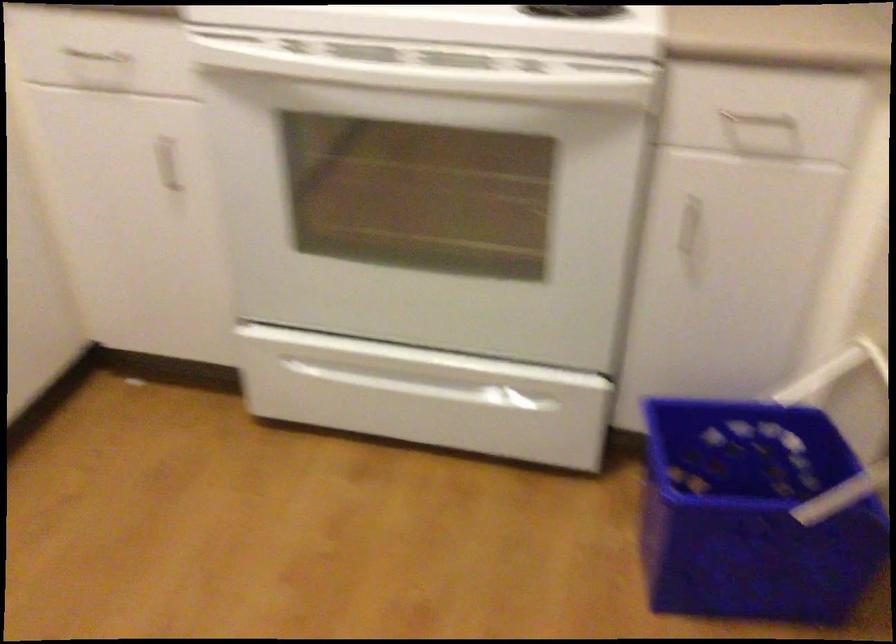
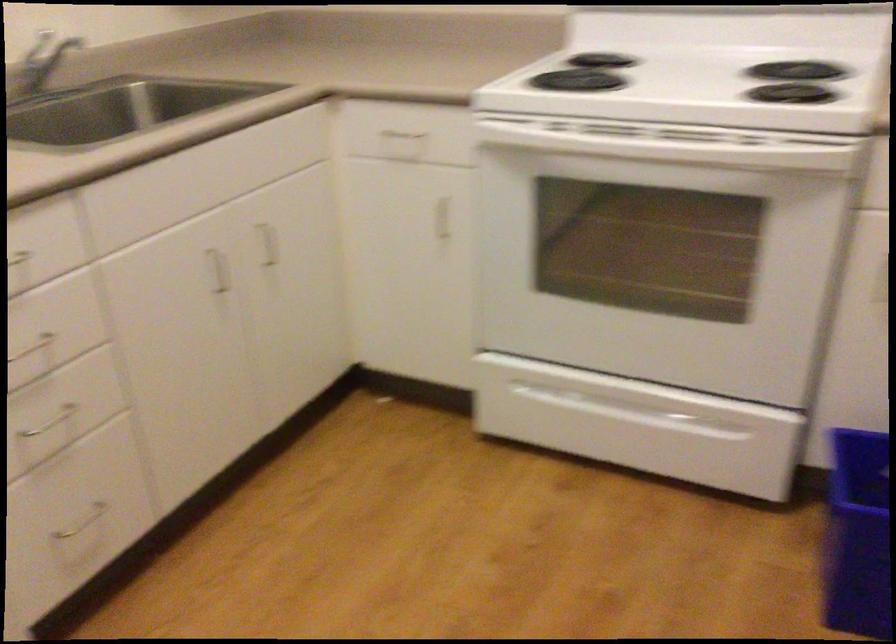
Question: How did the camera likely rotate?

Choices:
 (A) Left
 (B) Right
 (C) Up
 (D) Down

Answer: (A)